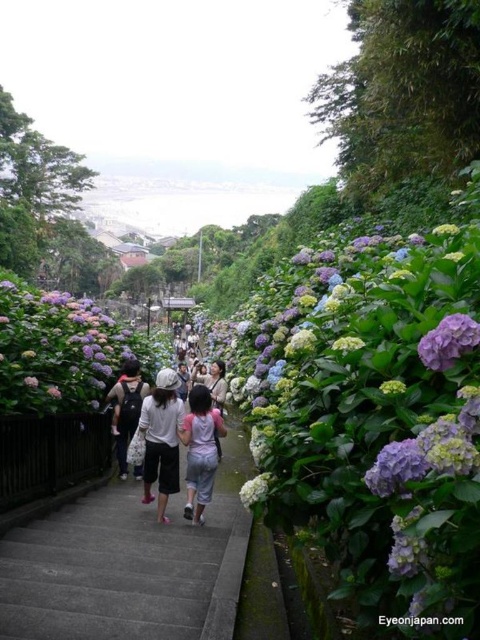
Question: Is purple matte hydrangea at center thinner than white cotton shirt at center?

Choices:
 (A) no
 (B) yes

Answer: (A)

Question: Which object appears closest to the camera in this image?

Choices:
 (A) purple matte hydrangea at right
 (B) light gray cotton shirt at center
 (C) white cotton shirt at center

Answer: (A)

Question: Where is purple matte hydrangea at center located in relation to white cotton shirt at center in the image?

Choices:
 (A) left
 (B) right

Answer: (A)

Question: Which object is the closest to the purple matte hydrangea at right?

Choices:
 (A) concrete stairs at center
 (B) white cotton shirt at center
 (C) light gray cotton shirt at center

Answer: (A)

Question: Is purple matte hydrangea at center-right positioned in front of pink fabric dress at center?

Choices:
 (A) yes
 (B) no

Answer: (A)

Question: Which object is the closest to the pink fabric dress at center?

Choices:
 (A) purple matte hydrangea at center-right
 (B) light gray cotton shirt at center

Answer: (B)